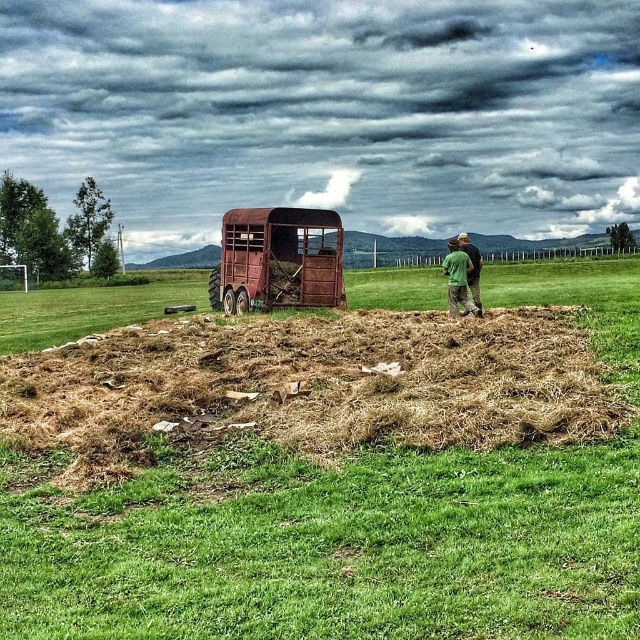
Question: Which is nearer to the brown dry grass at center?

Choices:
 (A) brown dry hay at center
 (B) green cotton shirt at right

Answer: (A)

Question: Is brown dry grass at center below green fabric shirt at upper right?

Choices:
 (A) no
 (B) yes

Answer: (B)

Question: Estimate the real-world distances between objects in this image. Which object is farther from the brown dry grass at center?

Choices:
 (A) green fabric shirt at upper right
 (B) brown dry hay at center
 (C) green cotton shirt at right

Answer: (C)

Question: Does brown dry grass at center come behind green cotton shirt at right?

Choices:
 (A) no
 (B) yes

Answer: (A)

Question: Is the position of green fabric shirt at upper right more distant than that of green cotton shirt at right?

Choices:
 (A) no
 (B) yes

Answer: (A)

Question: Which point is farther to the camera?

Choices:
 (A) (456, 269)
 (B) (461, 250)
 (C) (497, 305)

Answer: (C)